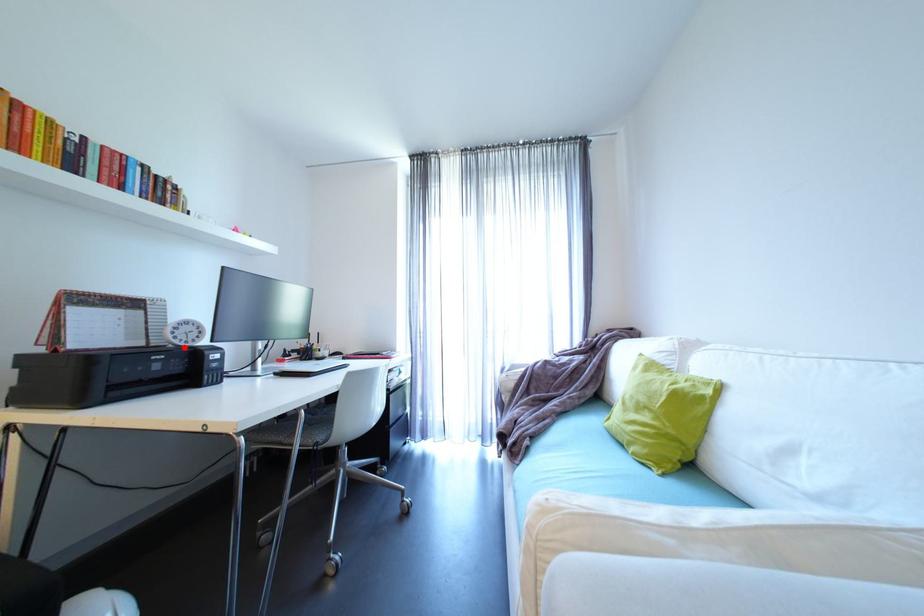
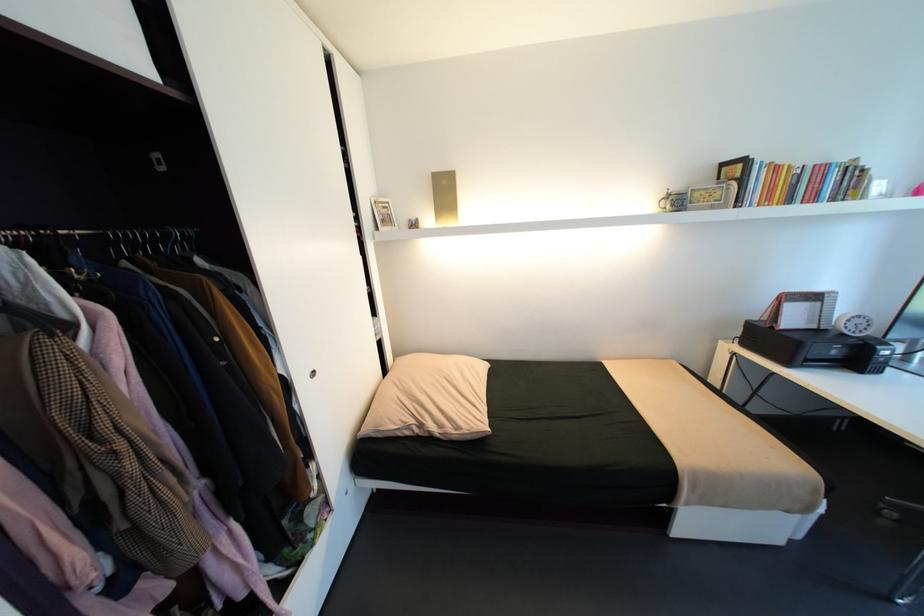
Find the pixel in the second image that matches the highlighted location in the first image.

(850, 334)